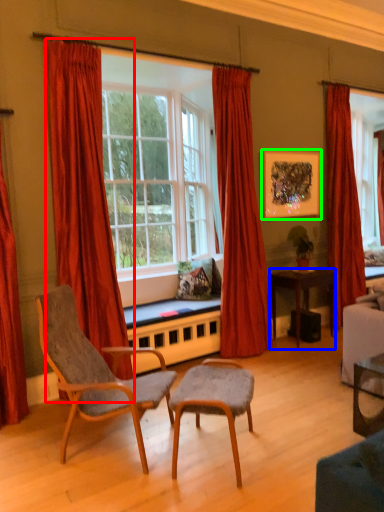
Question: Which object is the farthest from curtain (highlighted by a red box)? Choose among these: desk (highlighted by a blue box) or picture frame (highlighted by a green box).

Choices:
 (A) desk
 (B) picture frame

Answer: (A)